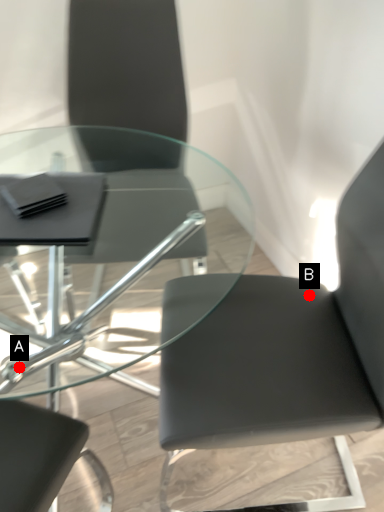
Question: Two points are circled on the image, labeled by A and B beside each circle. Among these points, which one is farthest from the camera?

Choices:
 (A) A is further
 (B) B is further

Answer: (A)